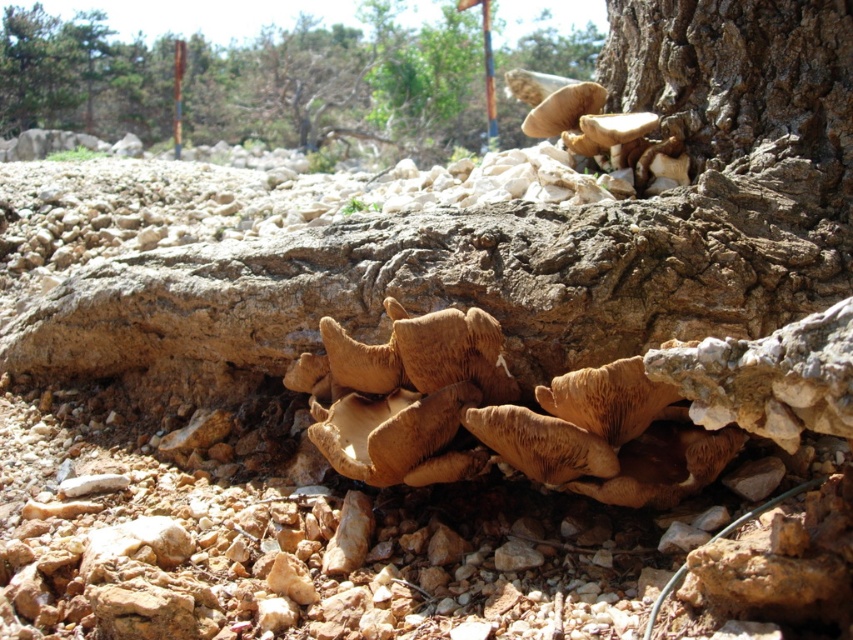
Who is more distant from viewer, (67, 104) or (415, 401)?

The point (67, 104) is more distant.

Is brown textured mushrooms at lower right below brown leathery fungi at center?

No, brown textured mushrooms at lower right is not below brown leathery fungi at center.

Describe the element at coordinates (254, 81) in the screenshot. I see `brown textured mushrooms at lower right` at that location.

What are the coordinates of `brown textured mushrooms at lower right` in the screenshot? It's located at [254, 81].